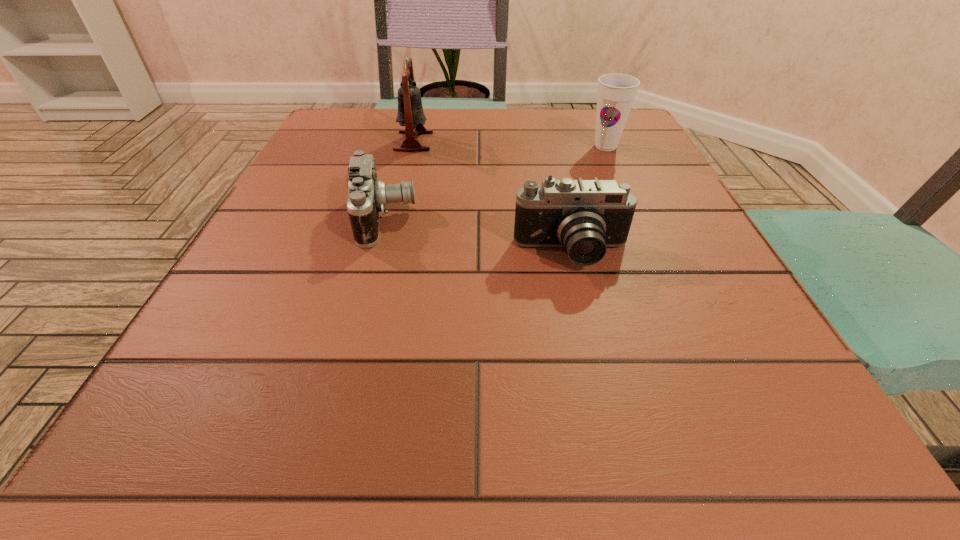
Where is `bell`? This screenshot has width=960, height=540. bell is located at coordinates (410, 114).

The image size is (960, 540). I want to click on cup, so click(616, 92).

Image resolution: width=960 pixels, height=540 pixels. In order to click on the taller camera in this screenshot , I will do `click(585, 217)`.

The height and width of the screenshot is (540, 960). Find the location of `the right camera`. the right camera is located at coordinates (585, 217).

Find the location of a particular element. Image resolution: width=960 pixels, height=540 pixels. the shortest object is located at coordinates (367, 196).

Locate an element on the screen. the left camera is located at coordinates (367, 196).

You are a GUI agent. You are given a task and a screenshot of the screen. Output one action in this format:
    pyautogui.click(x=<x>, y=<y>)
    Task: Click on the vacant space located on the back of the tallest object
    
    Given the screenshot: What is the action you would take?
    pyautogui.click(x=421, y=110)

Locate an element on the screen. Image resolution: width=960 pixels, height=540 pixels. vacant area situated 0.090m on the back of the second tallest object is located at coordinates (594, 122).

The image size is (960, 540). I want to click on free space located on the front-facing side of the taller camera, so click(x=610, y=414).

Identify the location of vacant space located 0.080m at the lens of the left camera. The width and height of the screenshot is (960, 540). (462, 218).